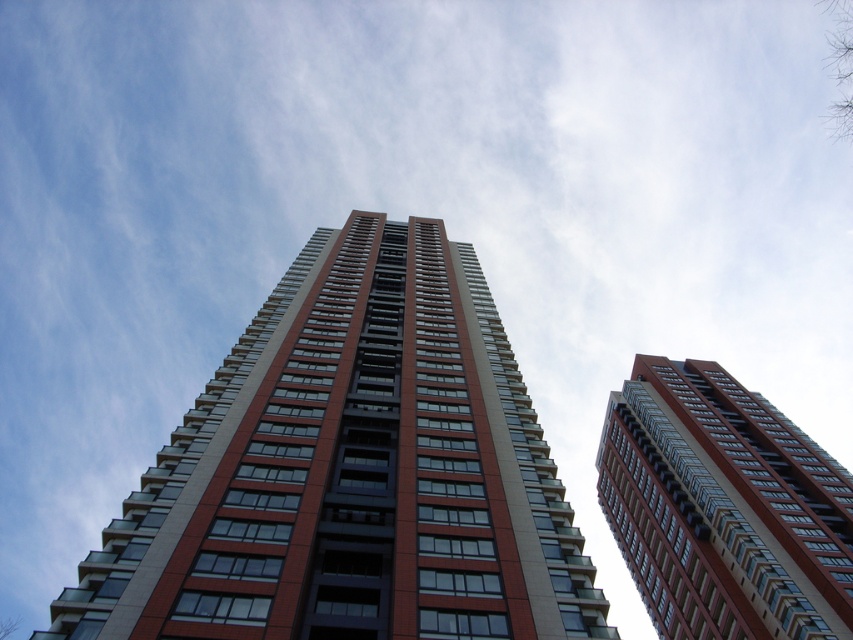
Question: Among these objects, which one is farthest from the camera?

Choices:
 (A) red brick building at center
 (B) matte red building at center

Answer: (B)

Question: Does red brick building at center appear on the right side of matte red building at center?

Choices:
 (A) yes
 (B) no

Answer: (B)

Question: Does red brick building at center have a greater width compared to matte red building at center?

Choices:
 (A) no
 (B) yes

Answer: (A)

Question: Which point is farther to the camera?

Choices:
 (A) red brick building at center
 (B) matte red building at center

Answer: (B)

Question: Which of the following is the closest to the observer?

Choices:
 (A) (751, 467)
 (B) (134, 561)

Answer: (B)

Question: Does red brick building at center have a lesser width compared to matte red building at center?

Choices:
 (A) no
 (B) yes

Answer: (B)